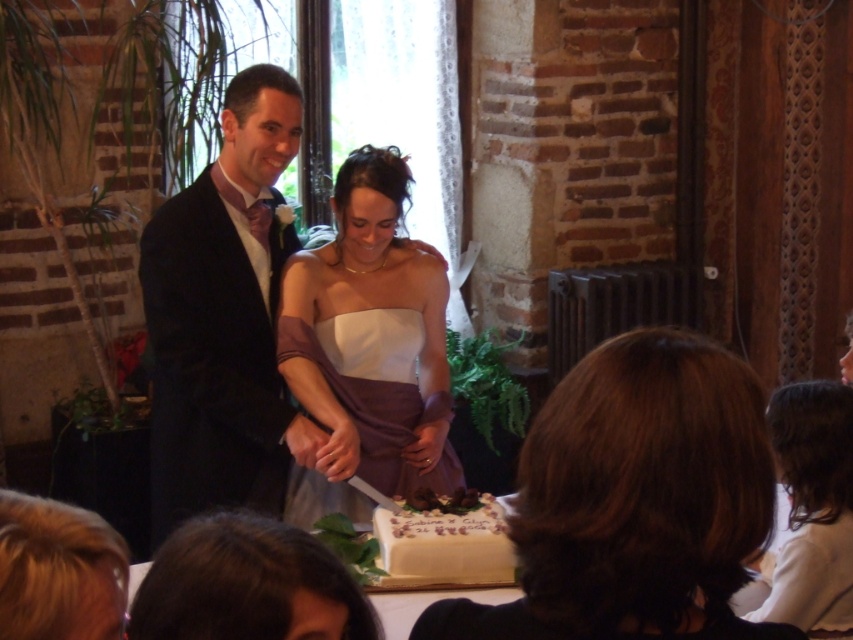
Question: Based on their relative distances, which object is farther from the white satin dress at lower right?

Choices:
 (A) white textured cake at center
 (B) matte black suit at center

Answer: (B)

Question: Which point is farther to the camera?

Choices:
 (A) matte black suit at center
 (B) white satin dress at lower right

Answer: (A)

Question: From the image, what is the correct spatial relationship of matte black suit at center in relation to white textured cake at center?

Choices:
 (A) above
 (B) below

Answer: (A)

Question: Which object is farther from the camera taking this photo?

Choices:
 (A) white satin dress at center
 (B) white satin dress at lower right

Answer: (A)

Question: Can you confirm if white satin dress at center is positioned to the left of white satin dress at lower right?

Choices:
 (A) yes
 (B) no

Answer: (A)

Question: Is the position of brown hair at center more distant than that of white textured cake at center?

Choices:
 (A) yes
 (B) no

Answer: (B)